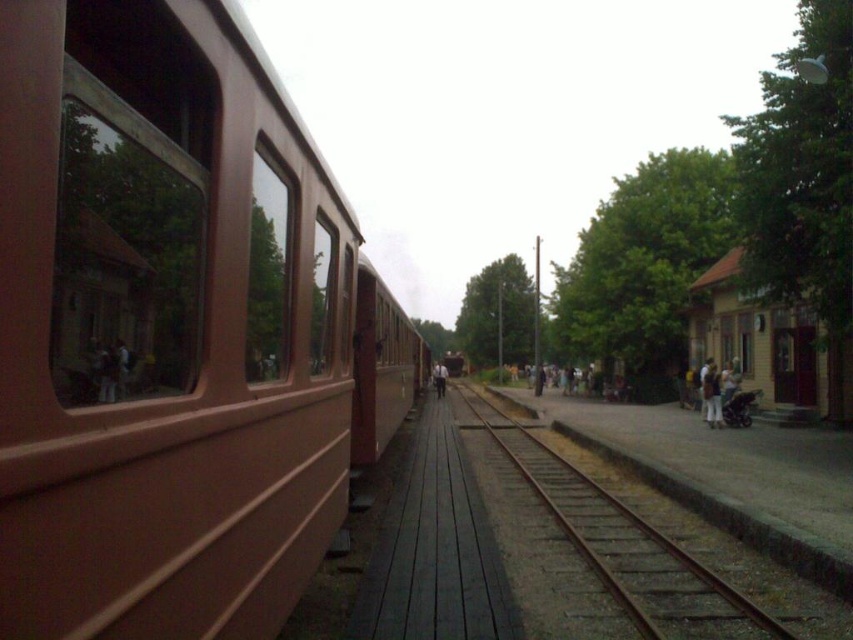
You are standing on the platform and see both the brown matte train at left and the light brown leather jacket at center. Which object is closer to the edge of the platform?

The brown matte train at left is closer to the edge of the platform because it is positioned to the left of the light brown leather jacket at center, which is further inward from the edge.